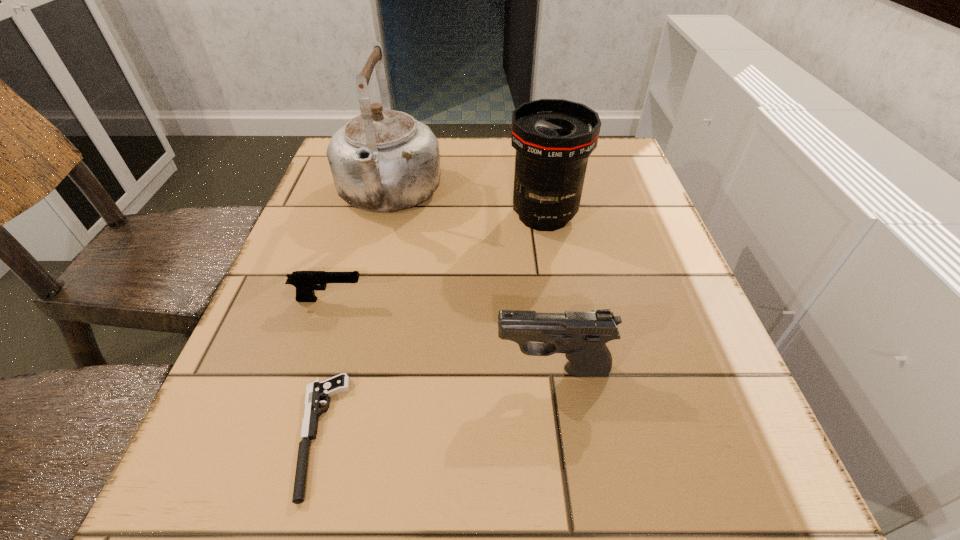
At what (x,y) coordinates should I click in order to perform the action: click on object positioned at the far left corner. Please return your answer as a coordinate pair (x, y). The height and width of the screenshot is (540, 960). Looking at the image, I should click on (383, 160).

You are a GUI agent. You are given a task and a screenshot of the screen. Output one action in this format:
    pyautogui.click(x=<x>, y=<y>)
    Task: Click on the object present at the near left corner
    Image resolution: width=960 pixels, height=540 pixels.
    Given the screenshot: What is the action you would take?
    pyautogui.click(x=317, y=390)

The width and height of the screenshot is (960, 540). Find the location of `blank space at the far edge of the desktop`. blank space at the far edge of the desktop is located at coordinates (485, 168).

This screenshot has width=960, height=540. In order to click on blank space at the near edge of the desktop in this screenshot , I will do `click(458, 523)`.

The width and height of the screenshot is (960, 540). In the image, there is a desktop. Find the location of `vacant space at the left edge`. vacant space at the left edge is located at coordinates (345, 268).

Where is `vacant region at the right edge of the desktop`? vacant region at the right edge of the desktop is located at coordinates (693, 330).

Identify the location of vacant space at the far left corner of the desktop. (325, 184).

I want to click on vacant space at the near left corner of the desktop, so click(202, 475).

This screenshot has height=540, width=960. I want to click on vacant space at the near right corner of the desktop, so click(x=772, y=482).

Identify the location of free space that is in between the second tallest object and the rightmost pistol. (548, 293).